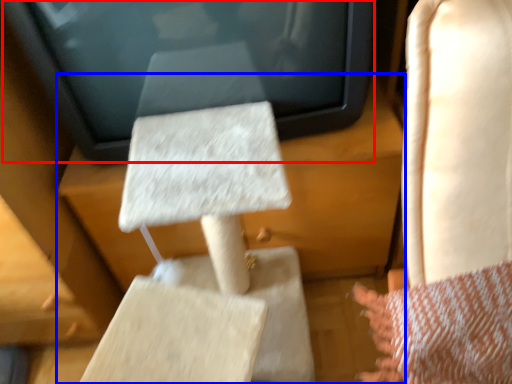
Question: Which object is further to the camera taking this photo, electronic (highlighted by a red box) or furniture (highlighted by a blue box)?

Choices:
 (A) electronic
 (B) furniture

Answer: (A)